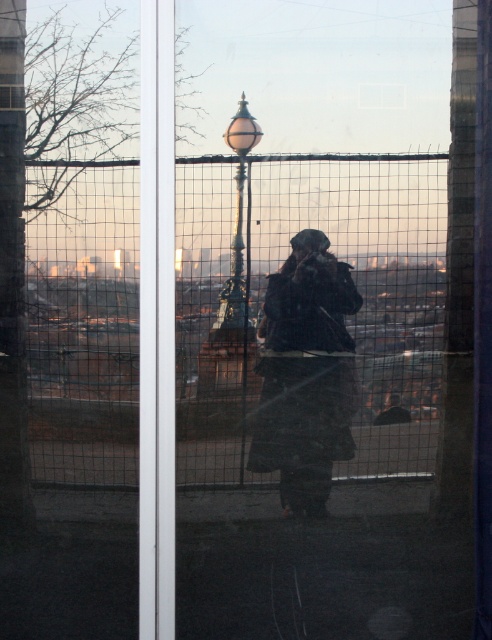
Does wire mesh fence at center have a lesser height compared to dark gray jacket at center?

Incorrect, wire mesh fence at center's height does not fall short of dark gray jacket at center's.

Does point (416, 225) come behind point (392, 419)?

No.

Image resolution: width=492 pixels, height=640 pixels. I want to click on wire mesh fence at center, so click(307, 316).

Which is more to the left, dark brown leather coat at center or dark gray jacket at center?

Positioned to the left is dark brown leather coat at center.

Locate an element on the screen. The width and height of the screenshot is (492, 640). dark brown leather coat at center is located at coordinates (306, 374).

I want to click on dark brown leather coat at center, so click(x=306, y=374).

Between point (337, 448) and point (280, 305), which one is positioned behind?

The point (280, 305) is behind.

Between wire mesh fence at center and dark brown leather coat at center, which one appears on the right side from the viewer's perspective?

From the viewer's perspective, dark brown leather coat at center appears more on the right side.

Which is behind, point (253, 296) or point (349, 340)?

The point (253, 296) is more distant.

This screenshot has height=640, width=492. In order to click on wire mesh fence at center in this screenshot , I will do `click(307, 316)`.